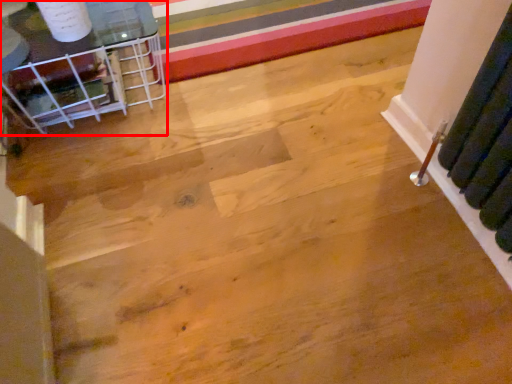
Question: From the image's perspective, considering the relative positions of furniture (annotated by the red box) and stripe in the image provided, where is furniture (annotated by the red box) located with respect to the staircase?

Choices:
 (A) below
 (B) above

Answer: (A)